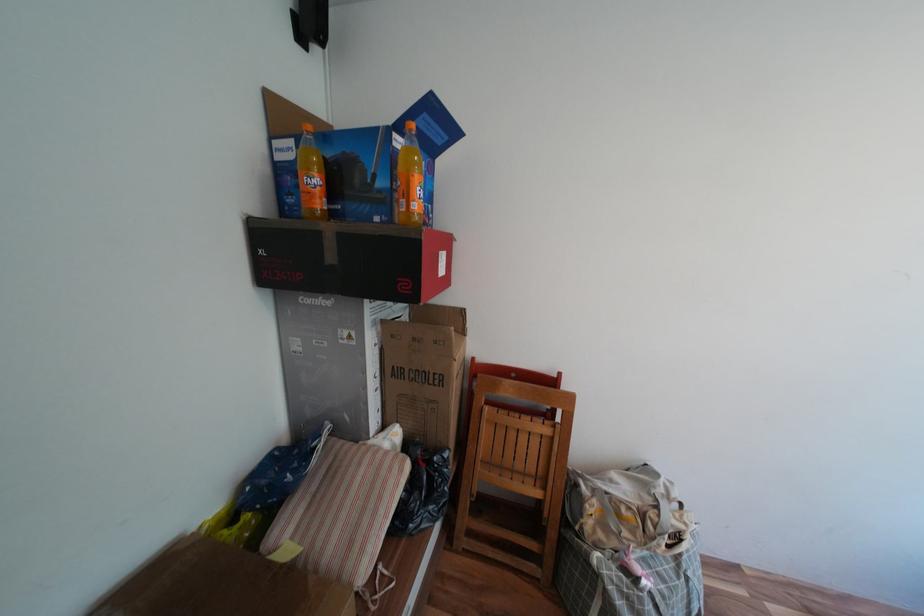
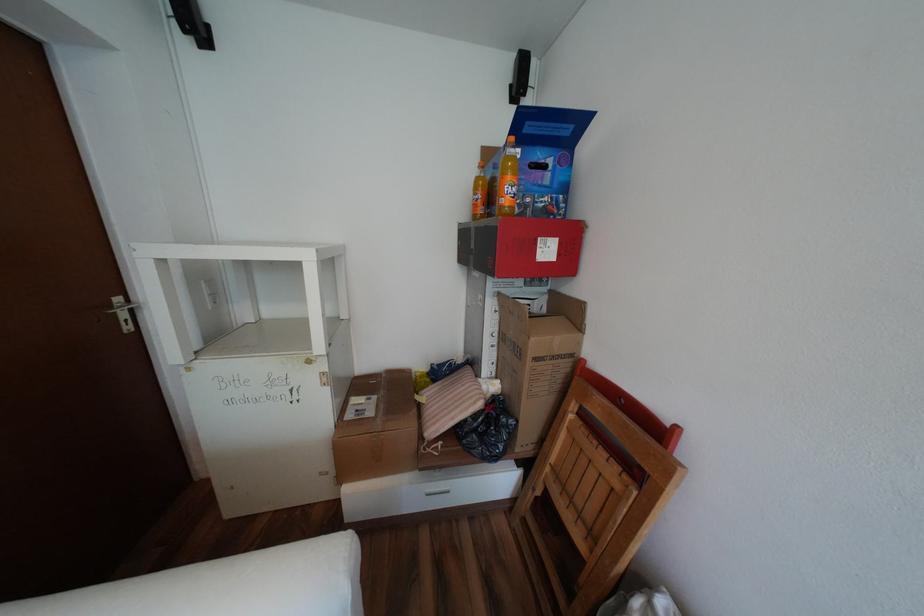
The point at (386, 374) is marked in the first image. Where is the corresponding point in the second image?

(505, 334)